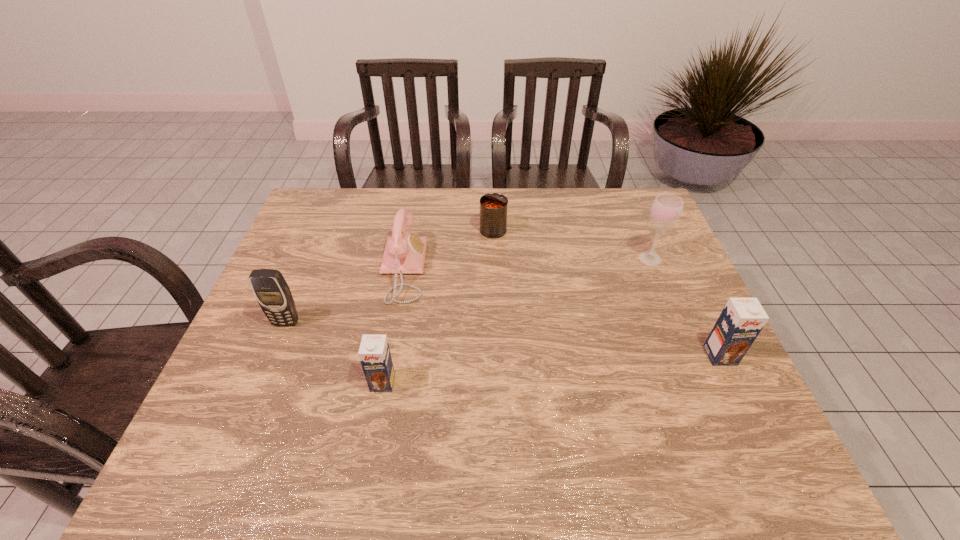
Locate an element on the screen. The width and height of the screenshot is (960, 540). the shorter chocolate milk is located at coordinates (374, 353).

Where is `the nearest object`? This screenshot has width=960, height=540. the nearest object is located at coordinates (374, 353).

Where is `the second nearest object`? Image resolution: width=960 pixels, height=540 pixels. the second nearest object is located at coordinates click(x=742, y=319).

Locate an element on the screen. Image resolution: width=960 pixels, height=540 pixels. the farther chocolate milk is located at coordinates (742, 319).

Where is `the fourth object from left to right`? This screenshot has height=540, width=960. the fourth object from left to right is located at coordinates (493, 206).

At what (x,y) coordinates should I click in order to perform the action: click on the leftmost object. Please return your answer as a coordinate pair (x, y). Looking at the image, I should click on (272, 292).

Identify the location of the fourth farthest object. This screenshot has height=540, width=960. (272, 292).

This screenshot has height=540, width=960. I want to click on telephone, so click(x=404, y=253).

Identify the location of wineglass. This screenshot has height=540, width=960. (666, 210).

The height and width of the screenshot is (540, 960). Find the location of `vacant region located on the front label of the second nearest object`. vacant region located on the front label of the second nearest object is located at coordinates (739, 396).